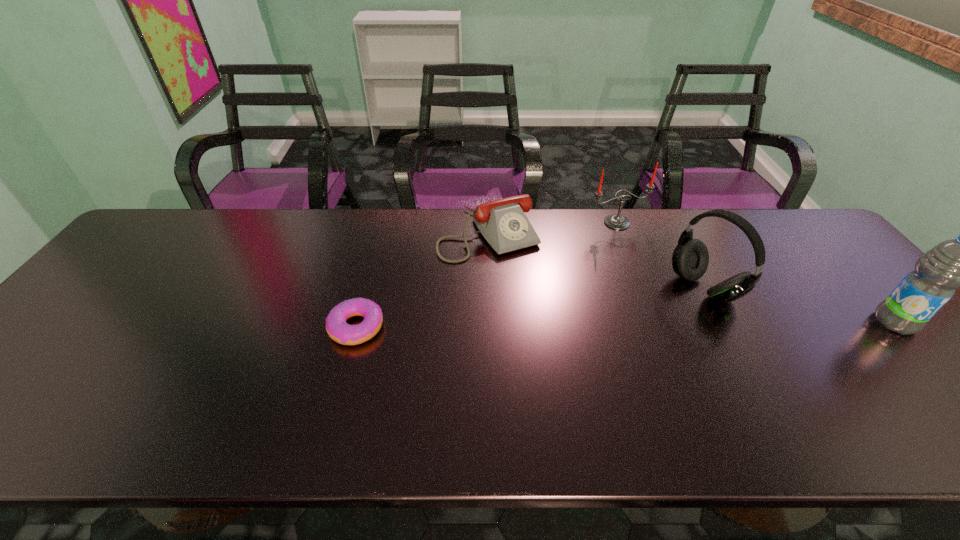
Locate an element on the screen. This screenshot has width=960, height=540. vacant space on the desktop that is between the leftmost object and the rightmost object and is positioned on the ear cups of the headset is located at coordinates (635, 325).

Where is `vacant spot on the desktop that is between the leftmost object and the rightmost object and is positioned on the dial of the fourth object from right to left`? The width and height of the screenshot is (960, 540). vacant spot on the desktop that is between the leftmost object and the rightmost object and is positioned on the dial of the fourth object from right to left is located at coordinates (550, 325).

In order to click on free space on the desktop that is between the leftmost object and the water bottle and is positioned on the front-facing side of the candle in this screenshot , I will do `click(702, 324)`.